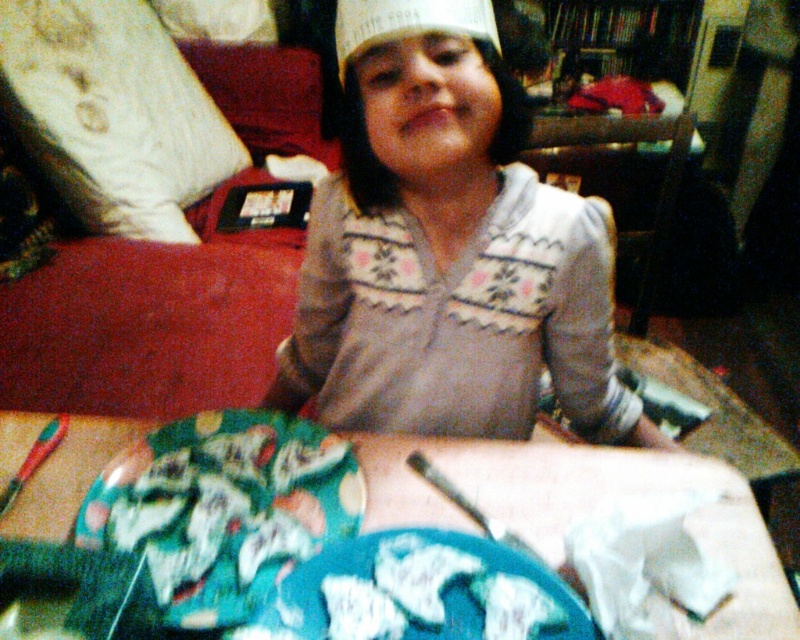
Question: Which is farther from the white paper hat at center?

Choices:
 (A) floral paper plate at lower center
 (B) white knitwear at center
 (C) blue fabric platter at center
 (D) wooden table at center

Answer: (C)

Question: In this image, where is floral paper plate at lower center located relative to blue fabric platter at center?

Choices:
 (A) right
 (B) left

Answer: (B)

Question: Which of the following is the farthest from the observer?

Choices:
 (A) floral paper plate at lower center
 (B) blue fabric platter at center

Answer: (A)

Question: Is floral paper plate at lower center bigger than blue fabric platter at center?

Choices:
 (A) yes
 (B) no

Answer: (A)

Question: Is blue fabric platter at center below white paper hat at center?

Choices:
 (A) no
 (B) yes

Answer: (B)

Question: Estimate the real-world distances between objects in this image. Which object is closer to the white paper hat at center?

Choices:
 (A) wooden table at center
 (B) blue fabric platter at center
 (C) floral paper plate at lower center
 (D) white knitwear at center

Answer: (D)